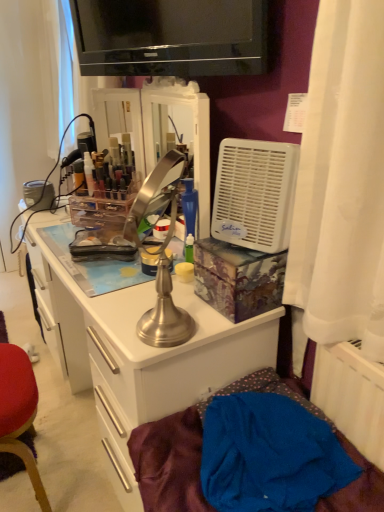
Identify the location of vacant space behind brushed metal table lamp at center. The image size is (384, 512). [x=149, y=292].